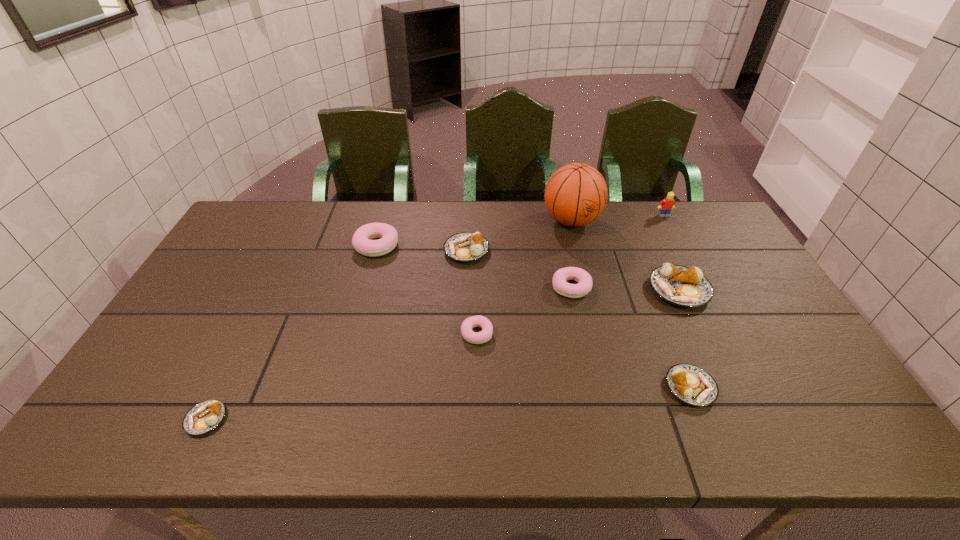
Where is `blank region between the leftmost brown pastry and the second smallest pink pastry`? blank region between the leftmost brown pastry and the second smallest pink pastry is located at coordinates (389, 353).

I want to click on vacant area between the farthest brown pastry and the smallest brown pastry, so click(x=336, y=335).

In order to click on free area in between the rightmost pink pastry and the tallest object in this screenshot , I will do click(x=571, y=254).

Find the location of a particular element. The width and height of the screenshot is (960, 540). empty space that is in between the second biggest pink pastry and the tallest object is located at coordinates (571, 254).

This screenshot has width=960, height=540. In order to click on free point between the eighth object from right to left and the farthest brown pastry in this screenshot , I will do `click(421, 248)`.

Choose which object is the nearest neighbor to the nearest pink pastry. Please provide its 2D coordinates. Your answer should be formatted as a tuple, i.e. [(x, y)], where the tuple contains the x and y coordinates of a point satisfying the conditions above.

[(584, 286)]

Choose which object is the seventh nearest neighbor to the third smallest brown pastry. Please provide its 2D coordinates. Your answer should be formatted as a tuple, i.e. [(x, y)], where the tuple contains the x and y coordinates of a point satisfying the conditions above.

[(667, 204)]

The image size is (960, 540). What are the coordinates of `the sixth closest pastry to the smallest brown pastry` in the screenshot? It's located at (687, 287).

At what (x,y) coordinates should I click in order to perform the action: click on pastry that stands as the fourth closest to the second object from left to right. Please return your answer as a coordinate pair (x, y). The image size is (960, 540). Looking at the image, I should click on (205, 416).

The image size is (960, 540). I want to click on brown pastry that is the third closest to the leftmost object, so click(687, 287).